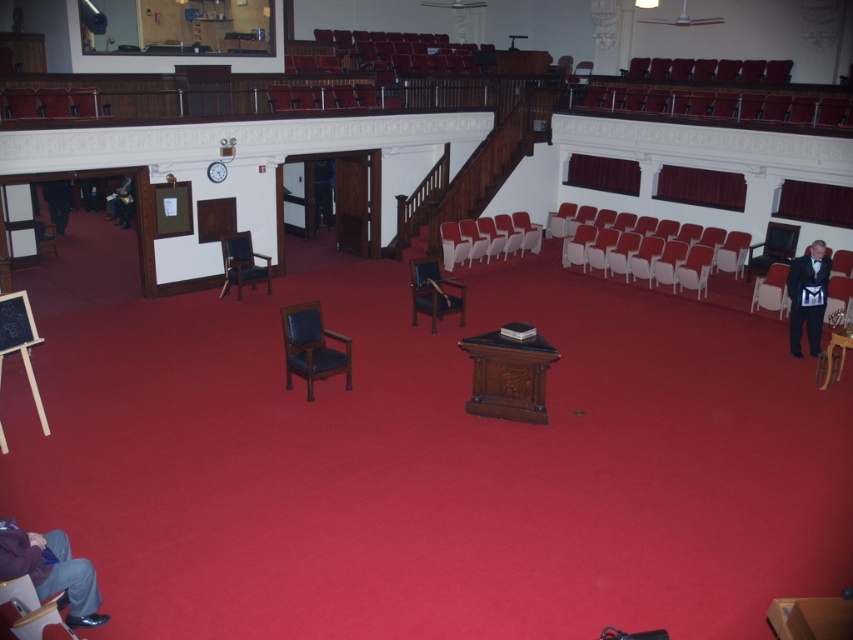
Question: Can you confirm if dark blue leather armchair at center is positioned above velvet dark blue armchair at right?

Choices:
 (A) no
 (B) yes

Answer: (B)

Question: Is denim pants at lower left wider than matte blue armchair at center?

Choices:
 (A) yes
 (B) no

Answer: (B)

Question: Does black satin bow tie at right appear under matte blue armchair at lower left?

Choices:
 (A) yes
 (B) no

Answer: (B)

Question: Among these objects, which one is farthest from the camera?

Choices:
 (A) matte blue armchair at lower left
 (B) dark blue leather jacket at left
 (C) denim pants at lower left
 (D) matte black armchair at right

Answer: (B)

Question: Which object is positioned closest to the denim pants at lower left?

Choices:
 (A) dark blue leather armchair at center
 (B) matte black armchair at right

Answer: (A)

Question: Which of the following is the farthest from the observer?

Choices:
 (A) (296, 353)
 (B) (6, 621)
 (C) (763, 294)
 (D) (796, 348)

Answer: (C)